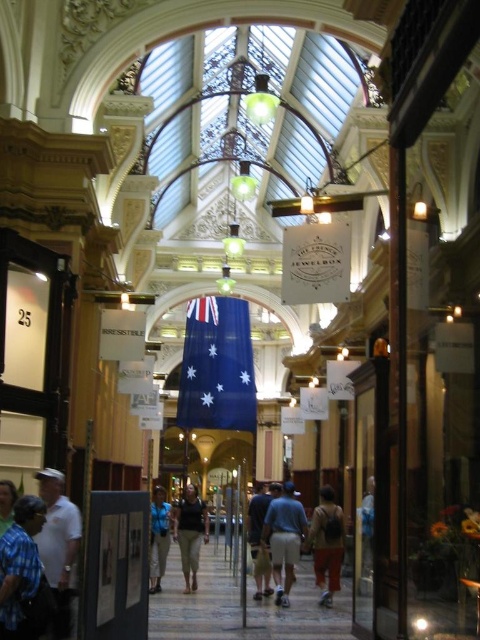
Does point (252, 410) come closer to viewer compared to point (60, 536)?

No, it is not.

Does blue fabric flag at center have a greater height compared to white shirt at lower left?

Correct, blue fabric flag at center is much taller as white shirt at lower left.

This screenshot has height=640, width=480. What do you see at coordinates (216, 365) in the screenshot?
I see `blue fabric flag at center` at bounding box center [216, 365].

Find the location of a particular element. The height and width of the screenshot is (640, 480). blue fabric flag at center is located at coordinates 216,365.

Does blue plaid shirt at lower left appear on the right side of orange fabric pants at center?

Incorrect, blue plaid shirt at lower left is not on the right side of orange fabric pants at center.

Between blue plaid shirt at lower left and orange fabric pants at center, which one has more height?

orange fabric pants at center

Does point (37, 618) lie behind point (338, 588)?

No, (37, 618) is in front of (338, 588).

I want to click on blue plaid shirt at lower left, so click(x=21, y=570).

Is blue plaid shirt at lower left above denim pants at center?

Correct, blue plaid shirt at lower left is located above denim pants at center.

Which of these two, blue plaid shirt at lower left or denim pants at center, stands taller?

denim pants at center is taller.

Locate an element on the screen. This screenshot has width=480, height=640. blue plaid shirt at lower left is located at coordinates (21, 570).

This screenshot has height=640, width=480. I want to click on blue plaid shirt at lower left, so click(21, 570).